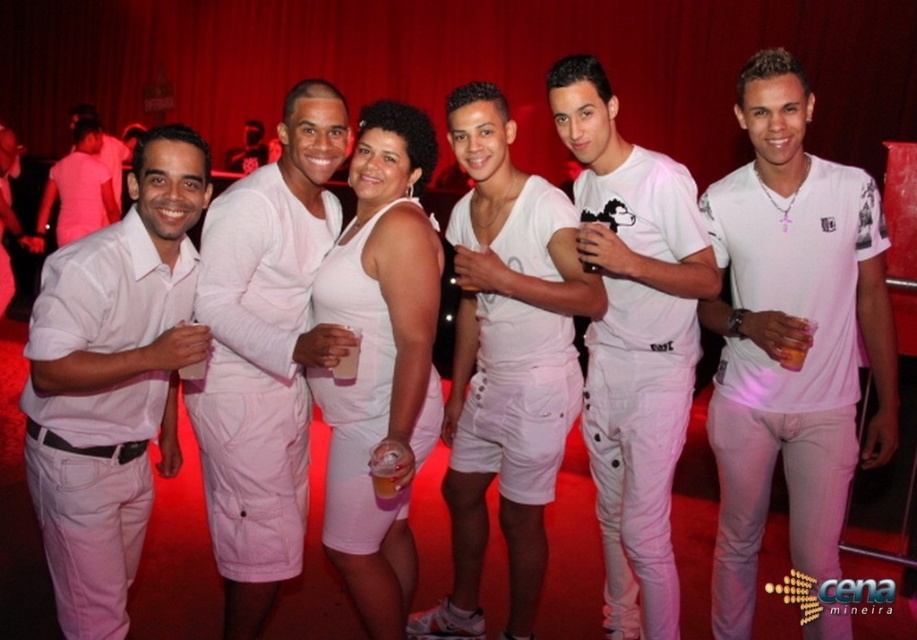
In the scene shown: Can you confirm if white fabric tank top at center is taller than matte white shorts at center?

Yes, white fabric tank top at center is taller than matte white shorts at center.

Between point (484, 465) and point (256, 556), which one is positioned in front?

Positioned in front is point (256, 556).

This screenshot has height=640, width=917. Identify the location of white fabric tank top at center. (505, 362).

Is white fabric tank top at center positioned behind white matte pants at center?

Yes, it is.

Where is `white fabric tank top at center`? white fabric tank top at center is located at coordinates (505, 362).

At what (x,y) coordinates should I click in order to perform the action: click on white matte pants at center. Please return your answer as a coordinate pair (x, y). The image size is (917, 640). Looking at the image, I should click on (633, 340).

Locate an element on the screen. This screenshot has width=917, height=640. white matte pants at center is located at coordinates tap(633, 340).